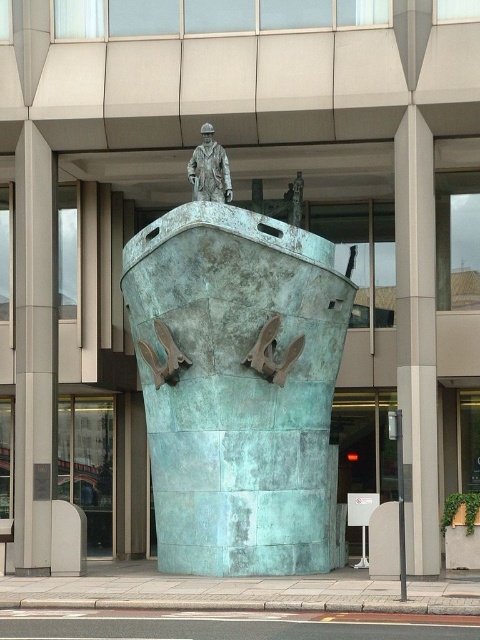
You are an art student standing in front of the sculpture. You want to sketch the bronze statue at center and the green patina anchor at lower center. Which object should you focus on first to capture their relative positions accurately?

The bronze statue at center should be sketched first as it is closer to the viewer than the green patina anchor at lower center, so it will appear larger and more prominent in the foreground.

You are a tour guide explaining the sculpture to visitors. Pointing to the bronze statue at center and the green patina anchor at lower center, you want to describe their positions relative to each other. Which object is positioned to the right of the other?

The bronze statue at center is to the right of the green patina anchor at lower center.

You are an architect inspecting the sculpture. You notice the smooth gray pillar at center right and the green patina anchor at center. From your vantage point, which object is closer to you?

The smooth gray pillar at center right is closer to you because the green patina anchor at center is behind it.